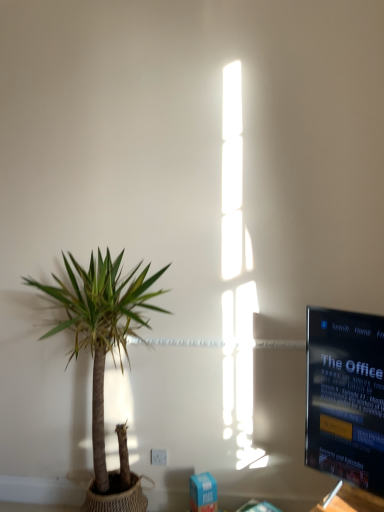
Question: From a real-world perspective, is white plastic electric outlet at lower center positioned under green leafy plant at left based on gravity?

Choices:
 (A) no
 (B) yes

Answer: (B)

Question: Is white plastic electric outlet at lower center far from green leafy plant at left?

Choices:
 (A) yes
 (B) no

Answer: (B)

Question: From the image's perspective, is white plastic electric outlet at lower center below green leafy plant at left?

Choices:
 (A) no
 (B) yes

Answer: (B)

Question: Can you confirm if white plastic electric outlet at lower center is taller than green leafy plant at left?

Choices:
 (A) yes
 (B) no

Answer: (B)

Question: Does white plastic electric outlet at lower center contain green leafy plant at left?

Choices:
 (A) no
 (B) yes

Answer: (A)

Question: Can you confirm if white plastic electric outlet at lower center is bigger than green leafy plant at left?

Choices:
 (A) no
 (B) yes

Answer: (A)

Question: Is white plastic electric outlet at lower center located within green leafy plant at left?

Choices:
 (A) yes
 (B) no

Answer: (A)

Question: From the image's perspective, does green leafy plant at left appear lower than white plastic electric outlet at lower center?

Choices:
 (A) yes
 (B) no

Answer: (B)

Question: From the image's perspective, is green leafy plant at left located above white plastic electric outlet at lower center?

Choices:
 (A) yes
 (B) no

Answer: (A)

Question: Can you confirm if green leafy plant at left is wider than white plastic electric outlet at lower center?

Choices:
 (A) yes
 (B) no

Answer: (A)

Question: Can you confirm if green leafy plant at left is taller than white plastic electric outlet at lower center?

Choices:
 (A) yes
 (B) no

Answer: (A)

Question: Is green leafy plant at left aimed at white plastic electric outlet at lower center?

Choices:
 (A) yes
 (B) no

Answer: (B)

Question: In the image, is green leafy plant at left on the left side or the right side of white plastic electric outlet at lower center?

Choices:
 (A) right
 (B) left

Answer: (B)